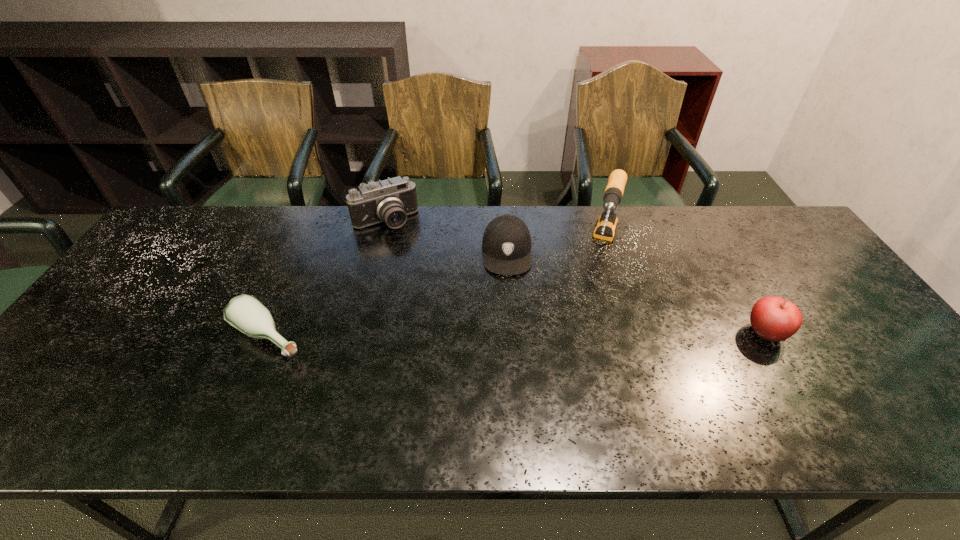
The height and width of the screenshot is (540, 960). I want to click on drill at the far edge, so click(x=606, y=225).

The image size is (960, 540). What are the coordinates of `camera that is positioned at the far edge` in the screenshot? It's located at [x=390, y=201].

The image size is (960, 540). In order to click on vacant space at the far edge in this screenshot , I will do `click(549, 226)`.

Where is `blank space at the near edge`? blank space at the near edge is located at coordinates tap(255, 399).

In the image, there is a desktop. Where is `vacant region at the right edge`? vacant region at the right edge is located at coordinates (832, 333).

Identify the location of vacant area at the near left corner of the desktop. (44, 377).

You are a GUI agent. You are given a task and a screenshot of the screen. Output one action in this format:
    pyautogui.click(x=<x>, y=<y>)
    Task: Click on the free space between the rightmost object and the camera
    The width and height of the screenshot is (960, 540).
    Given the screenshot: What is the action you would take?
    [575, 277]

This screenshot has width=960, height=540. In order to click on unoccupied area between the drill and the cap in this screenshot , I will do `click(556, 248)`.

The height and width of the screenshot is (540, 960). In order to click on blank region between the cap and the second tallest object in this screenshot , I will do `click(446, 237)`.

This screenshot has width=960, height=540. Identify the location of vacant area that lies between the cap and the fourth shortest object. (446, 237).